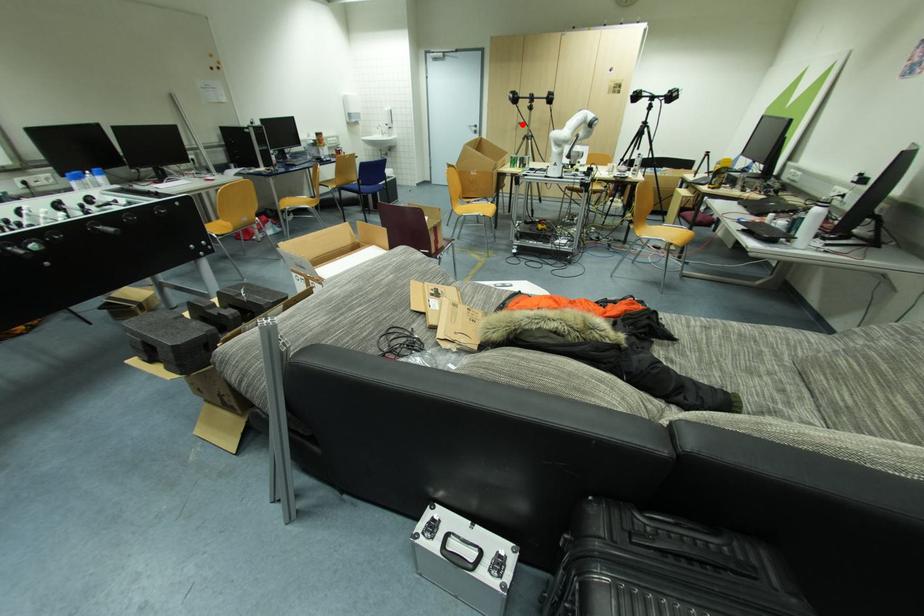
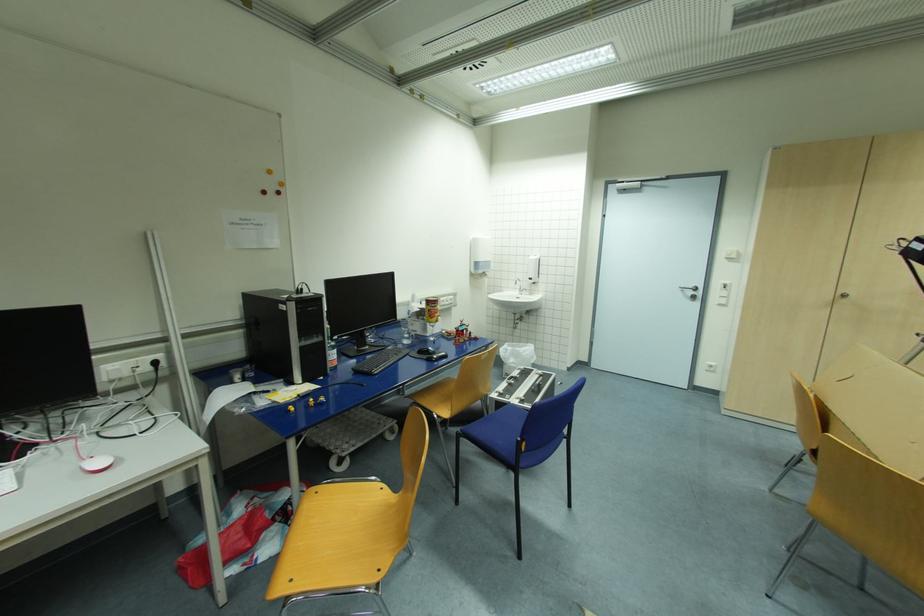
Locate, in the second image, the point that corresponds to the highlighted location in the first image.

(847, 296)